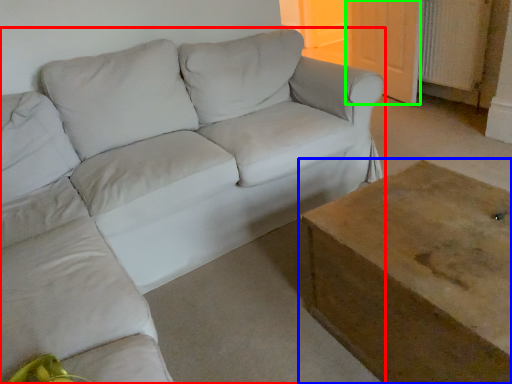
Question: Which object is positioned closest to studio couch (highlighted by a red box)? Select from table (highlighted by a blue box) and door (highlighted by a green box).

Choices:
 (A) table
 (B) door

Answer: (A)